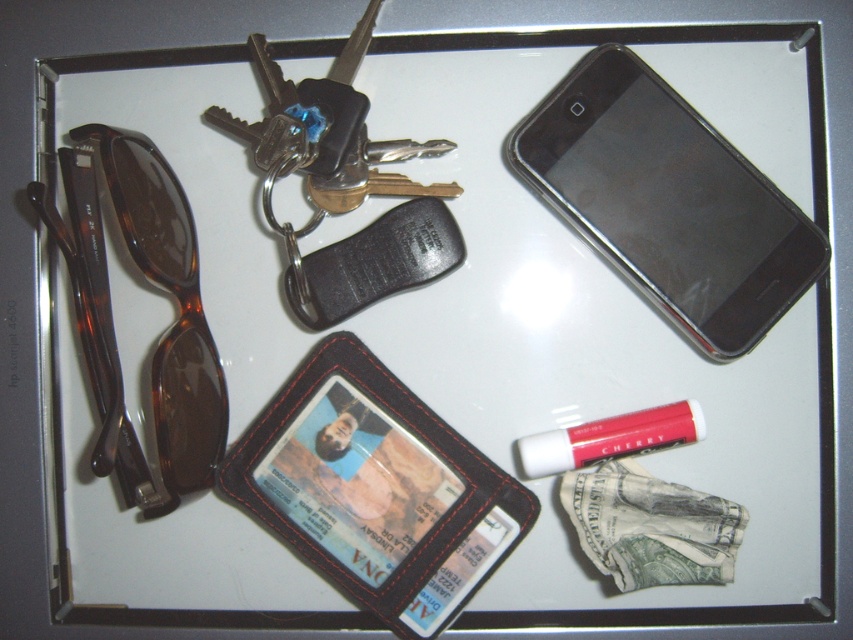
Question: Which of the following is the farthest from the observer?

Choices:
 (A) tortoiseshell plastic goggles at left
 (B) black plastic smartphone at upper right

Answer: (B)

Question: Can you confirm if tortoiseshell plastic goggles at left is positioned below matte cherry lipstick at lower right?

Choices:
 (A) no
 (B) yes

Answer: (A)

Question: Which point is closer to the camera?

Choices:
 (A) (688, 224)
 (B) (589, 440)
 (C) (74, 225)

Answer: (C)

Question: Which point is closer to the camera taking this photo?

Choices:
 (A) (701, 432)
 (B) (654, 97)

Answer: (A)

Question: Does black plastic smartphone at upper right lie in front of matte cherry lipstick at lower right?

Choices:
 (A) no
 (B) yes

Answer: (B)

Question: Is black plastic smartphone at upper right below tortoiseshell plastic goggles at left?

Choices:
 (A) yes
 (B) no

Answer: (B)